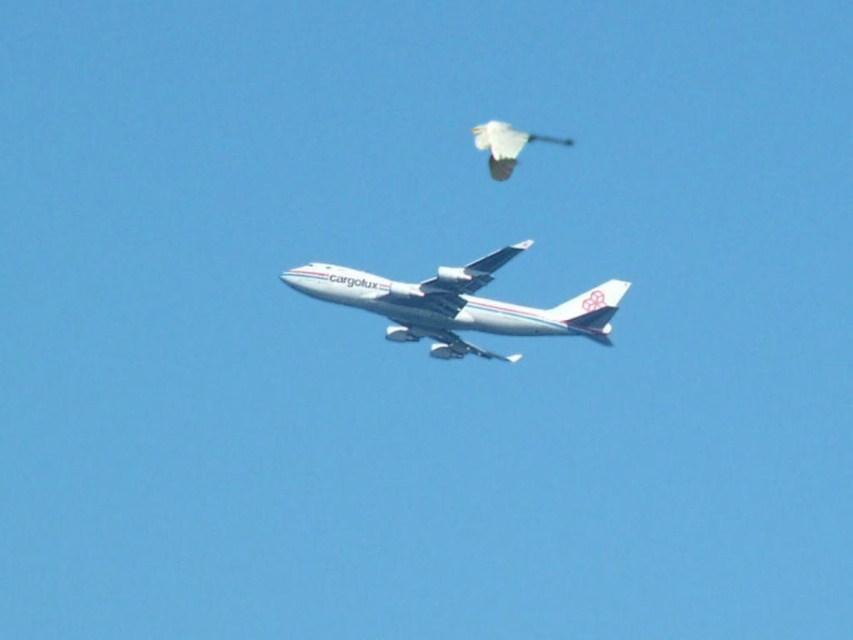
Which of these two, white glossy airplane at center or white matte bird at upper center, stands taller?

white matte bird at upper center is taller.

Looking at this image, who is positioned more to the right, white glossy airplane at center or white matte bird at upper center?

white matte bird at upper center is more to the right.

Who is more forward, (618, 288) or (494, 179)?

Positioned in front is point (618, 288).

Find the location of a particular element. This screenshot has width=853, height=640. white glossy airplane at center is located at coordinates (457, 305).